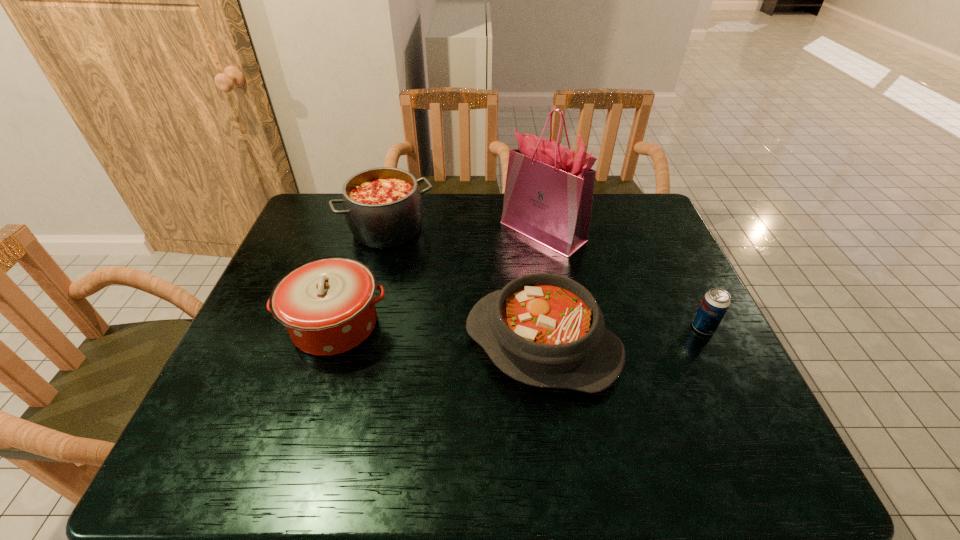
Locate an element on the screen. This screenshot has width=960, height=540. object that is positioned at the right edge is located at coordinates (715, 303).

The width and height of the screenshot is (960, 540). Find the location of `object located in the far left corner section of the desktop`. object located in the far left corner section of the desktop is located at coordinates (383, 207).

Where is `free space at the far edge of the desktop`? The image size is (960, 540). free space at the far edge of the desktop is located at coordinates (488, 193).

What are the coordinates of `vacant area at the near edge of the desktop` in the screenshot? It's located at (351, 443).

The height and width of the screenshot is (540, 960). I want to click on blank space at the left edge of the desktop, so click(294, 238).

I want to click on vacant space at the right edge of the desktop, so click(x=647, y=289).

Locate an element on the screen. The width and height of the screenshot is (960, 540). free space between the farthest casserole and the shortest casserole is located at coordinates (465, 287).

This screenshot has height=540, width=960. I want to click on vacant space that is in between the beer can and the shortest casserole, so click(x=623, y=336).

Identify the location of object that stands as the second closest to the rightmost casserole. This screenshot has height=540, width=960. (327, 305).

What are the coordinates of `object that is the fourth nearest to the rightmost object` in the screenshot? It's located at (327, 305).